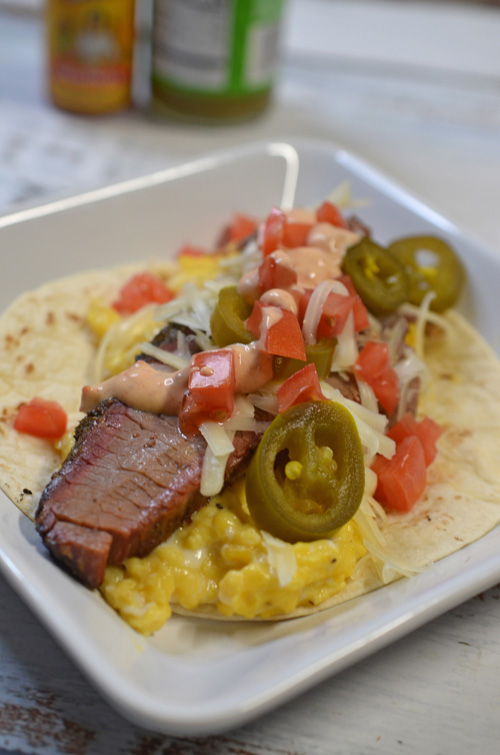
Locate an element on the screen. Image resolution: width=500 pixels, height=755 pixels. square plate is located at coordinates (173, 680).